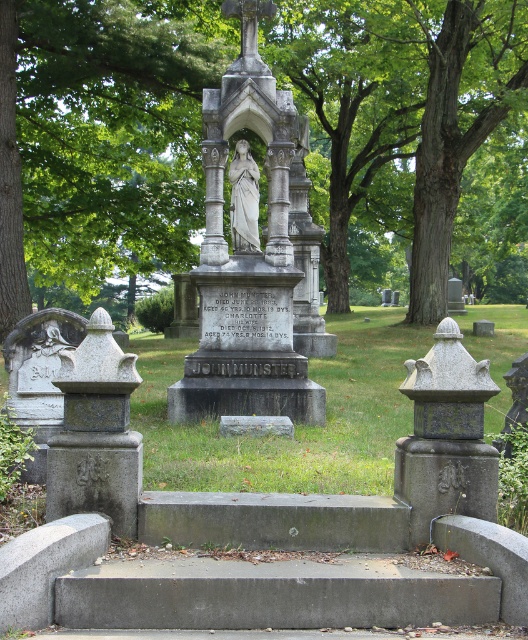
You are standing at the bottom of the steps leading to the central gravestone monument. You notice a point marked at coordinates (92, 131). What object does this point represent?

The point at coordinates (92, 131) represents a green leafy tree at center.

You are a tour guide explaining the cemetery to visitors. You mention both the polished stone statue at center and the white marble statue at center. Which one is wider?

The polished stone statue at center is wider than the white marble statue at center.

You are standing at the point marked by coordinates point (92, 131) in the cemetery scene. Looking around, you see the green leafy tree at center. Which direction should you walk to reach the gravestone monument at its center?

The point (92, 131) corresponds to the green leafy tree at center, so you are already at the center where the gravestone monument is located.